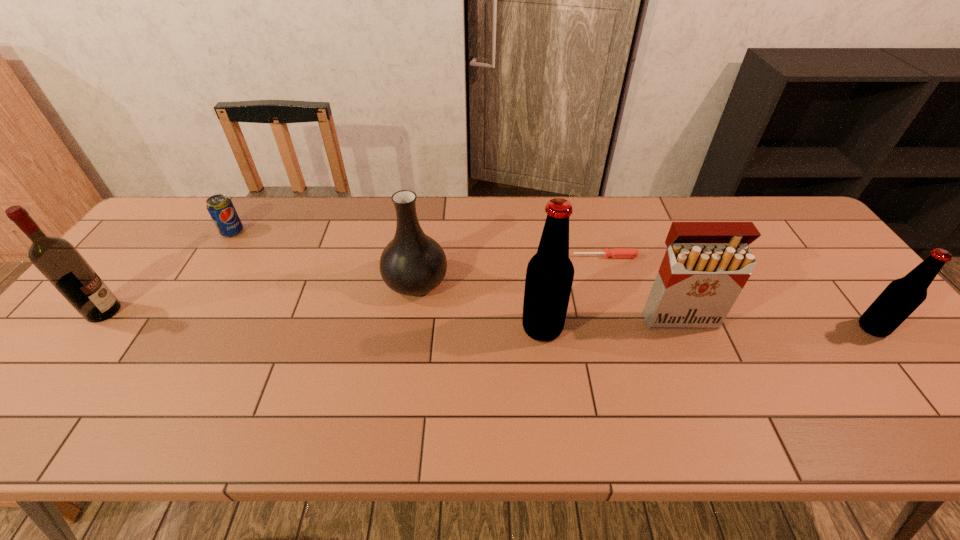
The beer bottles are evenly distributed in the image. To maintain this, where would you place another beer bottle on the left? Please point to a free space. Please provide its 2D coordinates. Your answer should be formatted as a tuple, i.e. [(x, y)], where the tuple contains the x and y coordinates of a point satisfying the conditions above.

[(212, 328)]